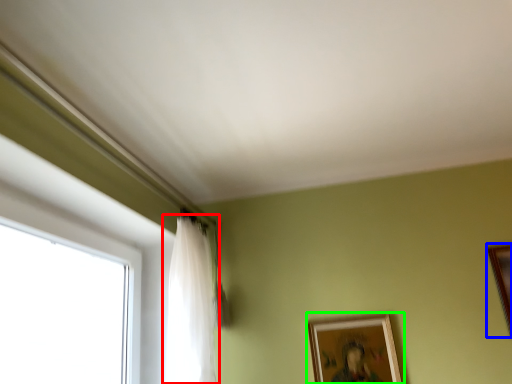
Question: Which object is the farthest from curtain (highlighted by a red box)? Choose among these: picture frame (highlighted by a blue box) or picture frame (highlighted by a green box).

Choices:
 (A) picture frame
 (B) picture frame

Answer: (A)